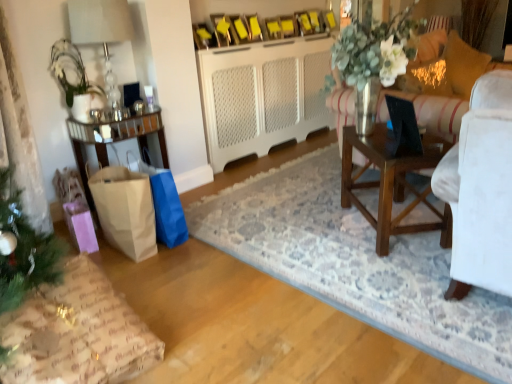
Question: From their relative heights in the image, would you say black plastic laptop at right is taller or shorter than brown paper bag at lower left, positioned as the 2th shopping bag in left-to-right order?

Choices:
 (A) tall
 (B) short

Answer: (B)

Question: From a real-world perspective, is black plastic laptop at right positioned above or below brown paper bag at lower left, positioned as the 2th shopping bag in left-to-right order?

Choices:
 (A) below
 (B) above

Answer: (B)

Question: Considering the real-world distances, which object is closest to the wrapping paper gift at lower left?

Choices:
 (A) black plastic laptop at right
 (B) brown paper bag at lower left, the 2th shopping bag when ordered from right to left
 (C) brown paper bag at lower left, the 1th shopping bag from the right
 (D) white fabric pillow at upper right, acting as the first pillow starting from the left
 (E) white textured cabinet at center

Answer: (B)

Question: Which is farther from the white fabric pillow at upper right, acting as the first pillow starting from the left?

Choices:
 (A) brown paper bag at left, which is the 1th table from left to right
 (B) wrapping paper gift at lower left
 (C) white textured cabinet at center
 (D) black plastic laptop at right
 (E) brown wooden table at center, the second table in the left-to-right sequence

Answer: (B)